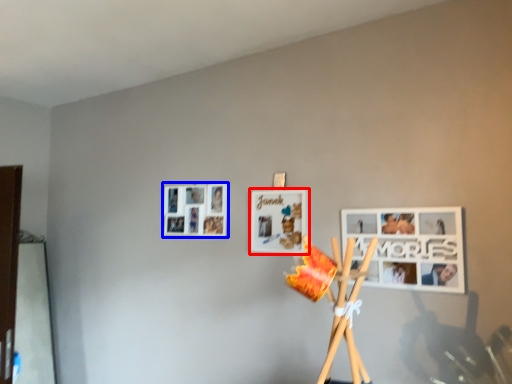
Question: Which point is further to the camera, picture frame (highlighted by a red box) or picture frame (highlighted by a blue box)?

Choices:
 (A) picture frame
 (B) picture frame

Answer: (B)